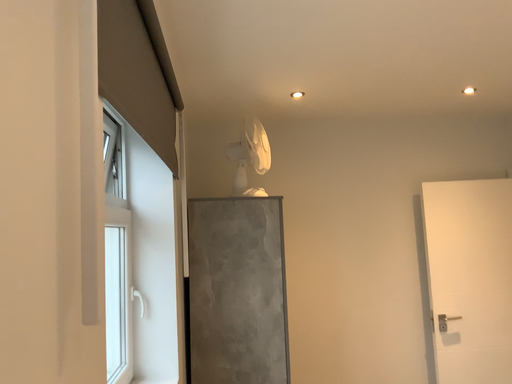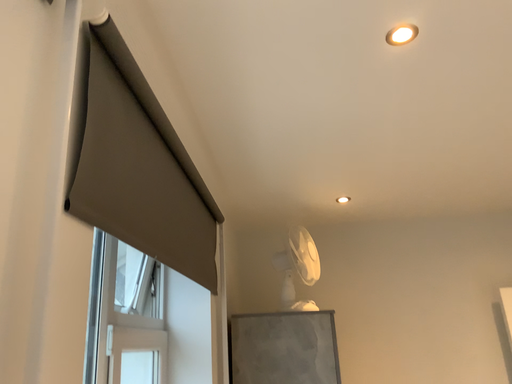
Question: How did the camera likely rotate when shooting the video?

Choices:
 (A) rotated left
 (B) rotated right

Answer: (A)